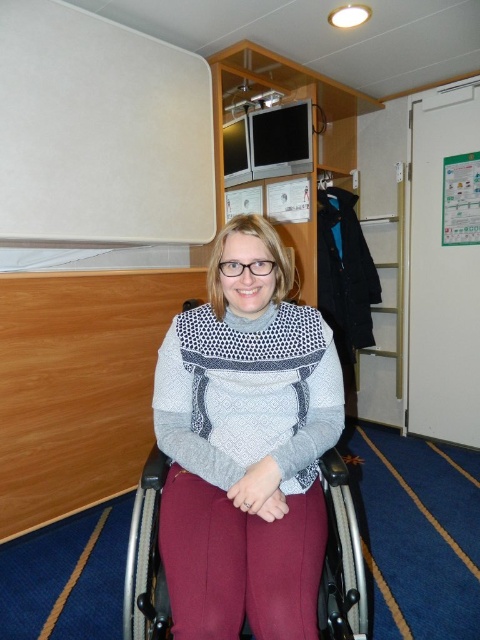
You are a tailor assessing the fit of two sweaters for a client. The client is sitting in a wheelchair in a compact room with wooden panels and a white curtain. You see the knitted gray sweater at center and the knitted wool sweater at center. Which sweater has a wider width according to the description?

The knitted gray sweater at center might be wider than knitted wool sweater at center.

You are helping someone choose an outfit and see the knitted gray sweater at center and the knitted wool sweater at center. Which one is positioned to the left?

The knitted gray sweater at center is positioned to the left of the knitted wool sweater at center.